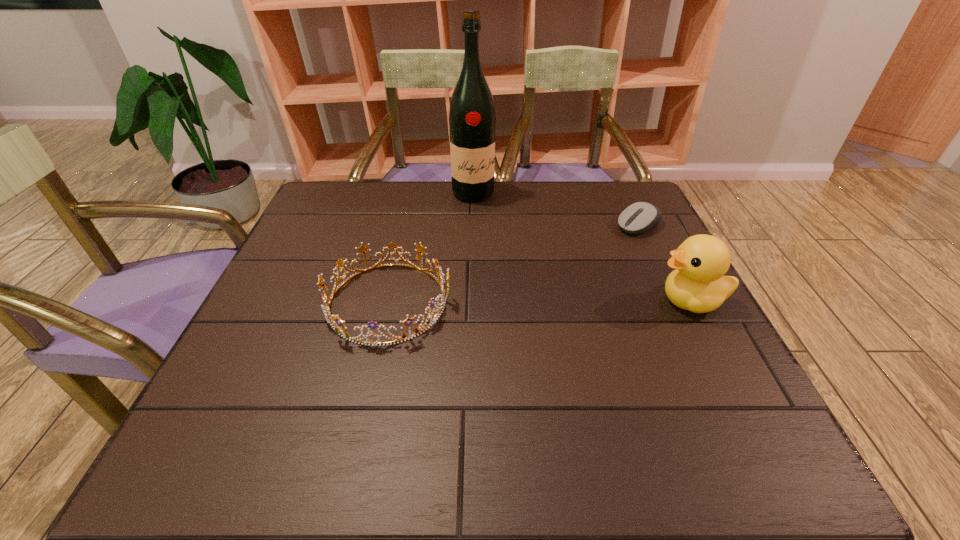
I want to click on free space that satisfies the following two spatial constraints: 1. on the front side of the shortest object; 2. on the face of the duck, so click(674, 301).